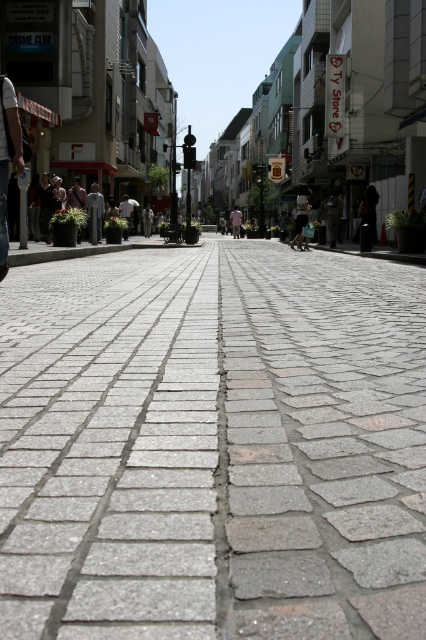
Consider the image. You are a photographer standing at the end of the street. You want to capture both the gray cobblestone pavement at center and the light pink shirt at center in your shot. Which object will appear smaller in the final photo?

The gray cobblestone pavement at center will appear smaller in the final photo because it has a smaller size compared to the light pink shirt at center.

You are a pedestrian standing on the gray cobblestone pavement at center. You want to reach the light pink shirt at center without stepping on the pavement. Is it possible?

The gray cobblestone pavement at center is below the light pink shirt at center, so you can reach it by stepping onto the area above the pavement where the shirt is located without stepping on the pavement itself.